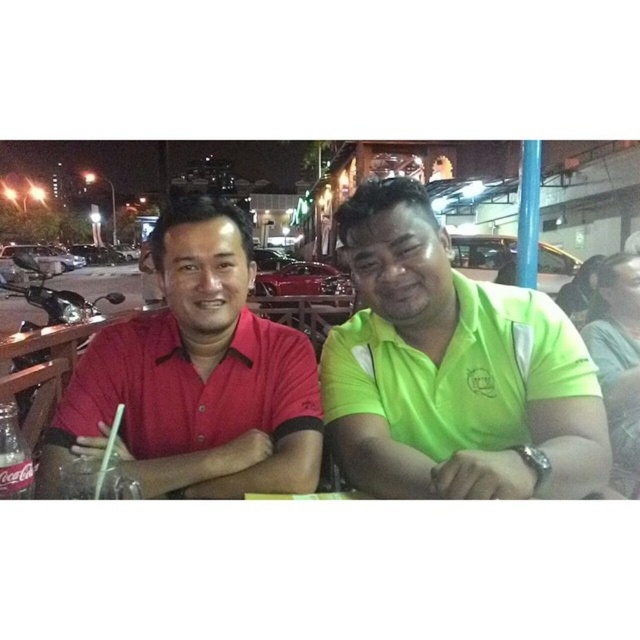
You are a photographer trying to capture both the green matte shirt at center and the matte red shirt at left in a single frame. Given their sizes, which shirt should you focus on to ensure both are clearly visible in the photo?

The green matte shirt at center is smaller than the matte red shirt at left, so focusing on the matte red shirt at left would allow the smaller green matte shirt at center to also be clearly visible in the frame.

Looking at this image, you are a photographer trying to capture a group photo of the green matte shirt at center and the matte red shirt at left. Since you want to ensure both are visible, which direction should you position yourself relative to the subjects to avoid blocking their view with your camera?

You should position yourself to the left of the green matte shirt at center and the matte red shirt at left so that neither of them is blocked from view. Since the green matte shirt at center is on the right side of the matte red shirt at left, positioning yourself to the left would allow you to see both clearly without obstruction.

You are a fashion designer observing the two individuals at the outdoor dining area. You need to determine which shirt has a smaller width between the green matte shirt at center and the matte red shirt at left. Which one is narrower?

The green matte shirt at center has a smaller width than the matte red shirt at left, so it is narrower.